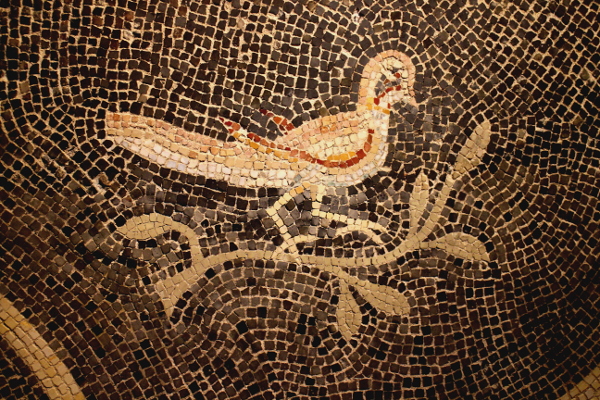
The image size is (600, 400). In order to click on yellow tile in this screenshot , I will do `click(37, 349)`.